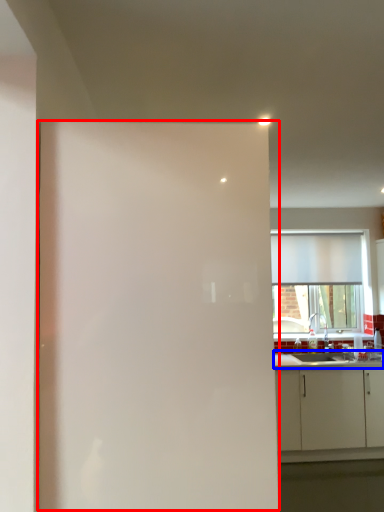
Question: Which object appears closest to the camera in this image, screen door (highlighted by a red box) or countertop (highlighted by a blue box)?

Choices:
 (A) screen door
 (B) countertop

Answer: (A)